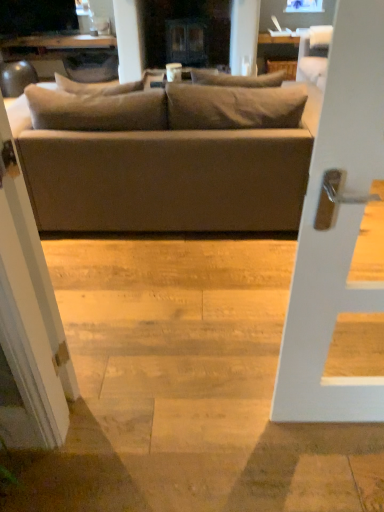
Question: Can you confirm if matte gray couch at center is shorter than matte black tv at upper left?

Choices:
 (A) yes
 (B) no

Answer: (B)

Question: Would you say matte gray couch at center is a long distance from matte black tv at upper left?

Choices:
 (A) no
 (B) yes

Answer: (B)

Question: Can you confirm if matte gray couch at center is taller than matte black tv at upper left?

Choices:
 (A) no
 (B) yes

Answer: (B)

Question: Considering the relative positions of matte gray couch at center and matte black tv at upper left in the image provided, is matte gray couch at center to the right of matte black tv at upper left from the viewer's perspective?

Choices:
 (A) yes
 (B) no

Answer: (A)

Question: Is matte gray couch at center facing towards matte black tv at upper left?

Choices:
 (A) yes
 (B) no

Answer: (B)

Question: Is point (334, 388) positioned closer to the camera than point (205, 138)?

Choices:
 (A) farther
 (B) closer

Answer: (B)

Question: From a real-world perspective, is white matte door handle at center positioned above or below matte gray couch at center?

Choices:
 (A) above
 (B) below

Answer: (A)

Question: Is white matte door handle at center taller or shorter than matte gray couch at center?

Choices:
 (A) tall
 (B) short

Answer: (A)

Question: Which is correct: white matte door handle at center is inside matte gray couch at center, or outside of it?

Choices:
 (A) outside
 (B) inside

Answer: (A)

Question: Is white glossy screen door at left to the left or to the right of matte gray couch at center in the image?

Choices:
 (A) left
 (B) right

Answer: (A)

Question: Is white glossy screen door at left in front of or behind matte gray couch at center in the image?

Choices:
 (A) front
 (B) behind

Answer: (A)

Question: Based on their sizes in the image, would you say white glossy screen door at left is bigger or smaller than matte gray couch at center?

Choices:
 (A) small
 (B) big

Answer: (A)

Question: In terms of height, does white glossy screen door at left look taller or shorter compared to matte gray couch at center?

Choices:
 (A) short
 (B) tall

Answer: (B)

Question: Is matte black tv at upper left taller or shorter than matte gray couch at center?

Choices:
 (A) short
 (B) tall

Answer: (A)

Question: Is matte black tv at upper left to the left or to the right of matte gray couch at center in the image?

Choices:
 (A) left
 (B) right

Answer: (A)